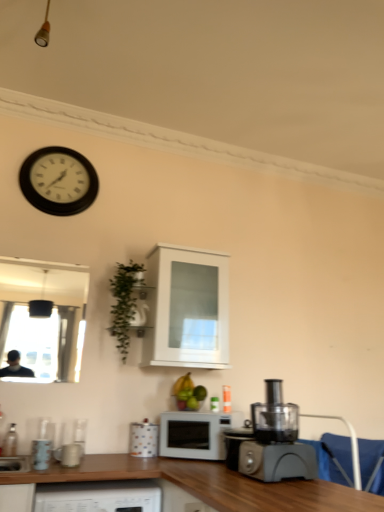
Question: Which direction should I rotate to look at polka dot ceramic mug at lower center, the 1th appliance from the back?

Choices:
 (A) left
 (B) right

Answer: (A)

Question: From the image's perspective, is green leafy plant at upper left located above clear glass bottle at lower left?

Choices:
 (A) no
 (B) yes

Answer: (B)

Question: Considering the relative sizes of green leafy plant at upper left and clear glass bottle at lower left in the image provided, is green leafy plant at upper left taller than clear glass bottle at lower left?

Choices:
 (A) no
 (B) yes

Answer: (B)

Question: From a real-world perspective, is green leafy plant at upper left under clear glass bottle at lower left?

Choices:
 (A) yes
 (B) no

Answer: (B)

Question: Is green leafy plant at upper left positioned with its back to clear glass bottle at lower left?

Choices:
 (A) yes
 (B) no

Answer: (B)

Question: Is green leafy plant at upper left further to the viewer compared to clear glass bottle at lower left?

Choices:
 (A) yes
 (B) no

Answer: (A)

Question: Considering the relative positions of green leafy plant at upper left and clear glass bottle at lower left in the image provided, is green leafy plant at upper left to the right of clear glass bottle at lower left from the viewer's perspective?

Choices:
 (A) yes
 (B) no

Answer: (A)

Question: From the image's perspective, is black plastic food processor at lower right located beneath black plastic clock at upper left?

Choices:
 (A) yes
 (B) no

Answer: (A)

Question: Can you confirm if black plastic food processor at lower right is wider than black plastic clock at upper left?

Choices:
 (A) no
 (B) yes

Answer: (B)

Question: Does black plastic food processor at lower right have a lesser width compared to black plastic clock at upper left?

Choices:
 (A) yes
 (B) no

Answer: (B)

Question: Is black plastic food processor at lower right to the right of black plastic clock at upper left from the viewer's perspective?

Choices:
 (A) yes
 (B) no

Answer: (A)

Question: Are black plastic food processor at lower right and black plastic clock at upper left making contact?

Choices:
 (A) no
 (B) yes

Answer: (A)

Question: Is black plastic food processor at lower right outside black plastic clock at upper left?

Choices:
 (A) no
 (B) yes

Answer: (B)

Question: Can you confirm if matte ceramic mug at lower left, the second appliance from the back, is positioned to the right of green leafy plant at upper left?

Choices:
 (A) no
 (B) yes

Answer: (A)